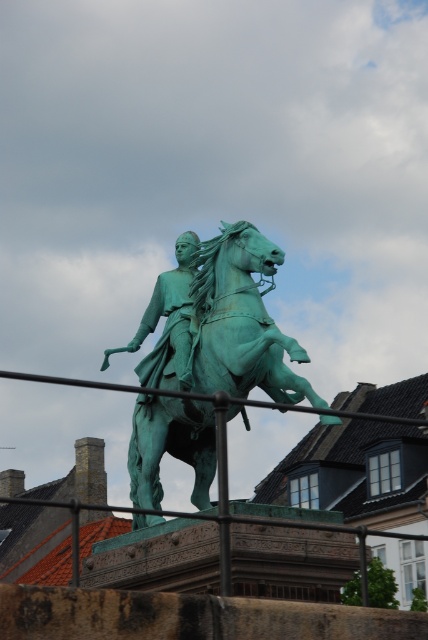
Can you confirm if green patinated bronze statue at center is smaller than rustic metal fence at center?

Yes.

Does point (205, 506) come closer to viewer compared to point (234, 403)?

No, (205, 506) is behind (234, 403).

This screenshot has width=428, height=640. I want to click on green patinated bronze statue at center, so click(x=228, y=324).

Is rustic metal fence at center below green patinated statue at center?

Yes, rustic metal fence at center is below green patinated statue at center.

Does rustic metal fence at center appear over green patinated statue at center?

Incorrect, rustic metal fence at center is not positioned above green patinated statue at center.

Who is more distant from viewer, (220, 429) or (163, 349)?

The point (163, 349) is more distant.

Where is `rustic metal fence at center`? rustic metal fence at center is located at coordinates (68, 381).

Can you confirm if green patinated bronze statue at center is wider than green patinated statue at center?

Correct, the width of green patinated bronze statue at center exceeds that of green patinated statue at center.

Between point (270, 272) and point (169, 282), which one is positioned behind?

The point (169, 282) is more distant.

Describe the element at coordinates (228, 324) in the screenshot. This screenshot has width=428, height=640. I see `green patinated bronze statue at center` at that location.

The height and width of the screenshot is (640, 428). I want to click on green patinated bronze statue at center, so click(x=228, y=324).